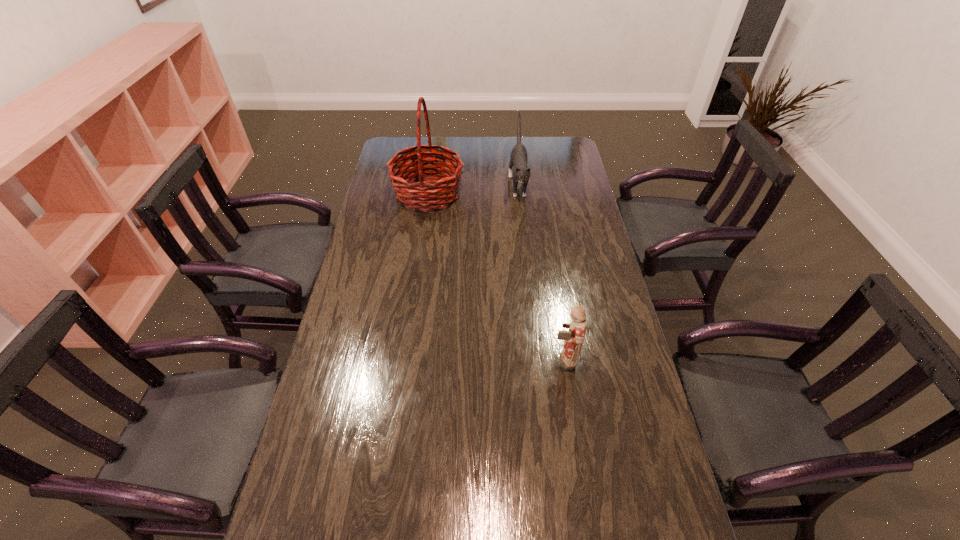
The image size is (960, 540). Identify the location of the tallest object. (x=418, y=194).

What are the coordinates of `basket` in the screenshot? It's located at (418, 194).

The width and height of the screenshot is (960, 540). I want to click on cat, so [x=518, y=159].

Locate an element on the screen. This screenshot has width=960, height=540. the nearest object is located at coordinates (574, 337).

Identify the location of free space located on the handle side of the basket. This screenshot has height=540, width=960. coord(511,194).

The height and width of the screenshot is (540, 960). Find the location of `vacant space located 0.390m at the face of the cat`. vacant space located 0.390m at the face of the cat is located at coordinates (528, 280).

Image resolution: width=960 pixels, height=540 pixels. Find the location of `vacant point located on the front-facing side of the nearest object`. vacant point located on the front-facing side of the nearest object is located at coordinates (477, 360).

You are a GUI agent. You are given a task and a screenshot of the screen. Output one action in this format:
    pyautogui.click(x=<x>, y=<y>)
    Task: Click on the vacant space situated 0.270m on the front-facing side of the nearest object
    The height and width of the screenshot is (540, 960).
    Given the screenshot: What is the action you would take?
    pyautogui.click(x=456, y=360)

Where is `vacant space located 0.250m on the front-facing side of the nearest object`? vacant space located 0.250m on the front-facing side of the nearest object is located at coordinates (463, 360).

Where is `object present at the far edge`? This screenshot has height=540, width=960. object present at the far edge is located at coordinates (518, 159).